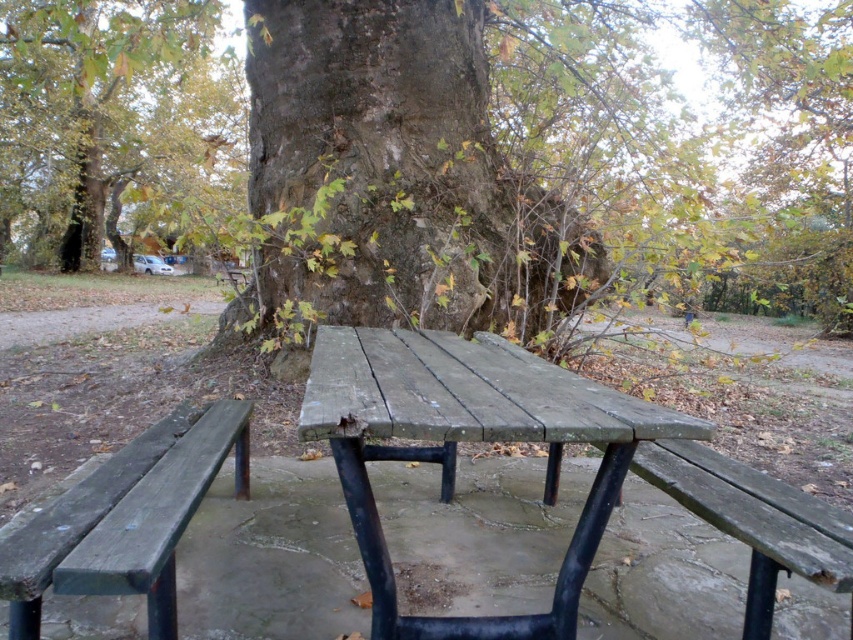
You are sitting at the green weathered wood picnic table at center and want to look at the green rough bark tree at upper left. In which direction should you turn your head?

You should turn your head to the left to look at the green rough bark tree at upper left since it is positioned to the left of the green weathered wood picnic table at center.

You are sitting on the weathered wood bench at center and want to reach the rough bark tree at center. Which direction should you move to get closer to the tree?

The rough bark tree at center is further to the viewer than the weathered wood bench at center, so you should move forward to get closer to the tree.

You are standing at the picnic table and want to take a photo of the rough bark tree at center. Where should you point your camera to capture it?

You should point your camera towards the center of the image where the rough bark tree at center is located at point coordinates of (433, 154).